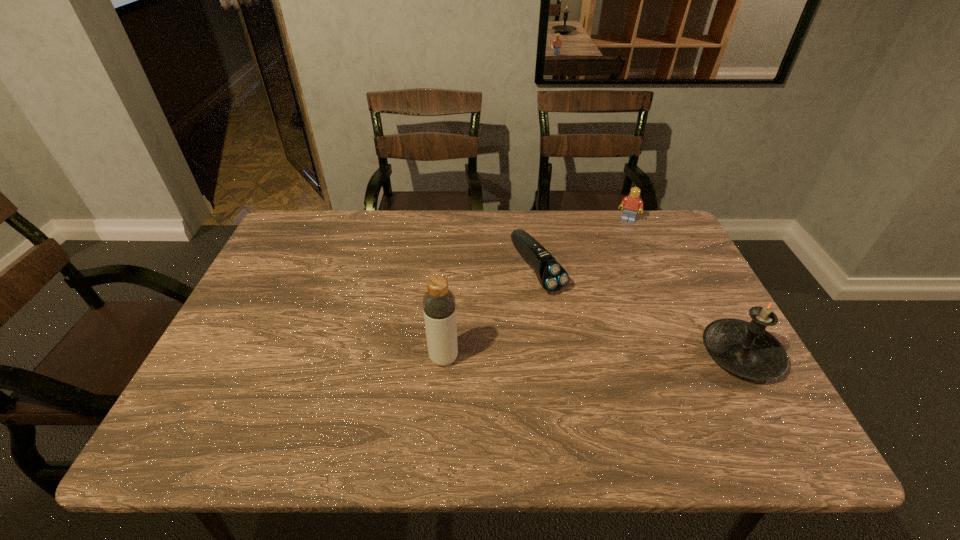
This screenshot has height=540, width=960. Identify the location of object that is at the far right corner. (632, 203).

Identify the location of object at the near right corner. The height and width of the screenshot is (540, 960). (746, 349).

In the image, there is a desktop. At what (x,y) coordinates should I click in order to perform the action: click on vacant space at the far edge. Please return your answer as a coordinate pair (x, y). This screenshot has height=540, width=960. Looking at the image, I should click on (474, 255).

Where is `vacant space at the near edge of the desktop`? The width and height of the screenshot is (960, 540). vacant space at the near edge of the desktop is located at coordinates (504, 404).

Identify the location of vacant region at the left edge of the desktop. (297, 321).

In the image, there is a desktop. In order to click on vacant region at the right edge in this screenshot , I will do `click(723, 313)`.

Where is `vacant space at the far left corner of the desktop`? vacant space at the far left corner of the desktop is located at coordinates (316, 247).

Locate an element on the screen. The width and height of the screenshot is (960, 540). free location at the far right corner is located at coordinates (621, 218).

Identify the location of vacant region between the candle and the Lego. (684, 287).

This screenshot has height=540, width=960. Find the location of `free spot between the leftmost object and the third shortest object`. free spot between the leftmost object and the third shortest object is located at coordinates (592, 356).